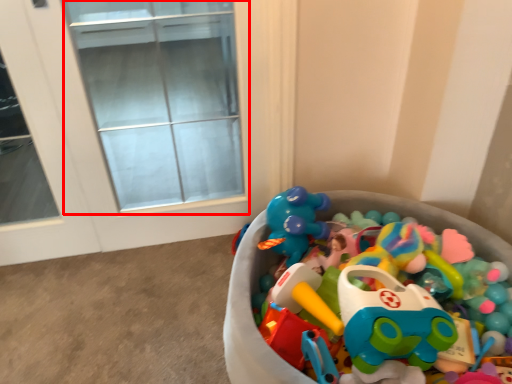
Question: Considering the relative positions of glass door (annotated by the red box) and toy in the image provided, where is glass door (annotated by the red box) located with respect to the staircase?

Choices:
 (A) left
 (B) right

Answer: (A)